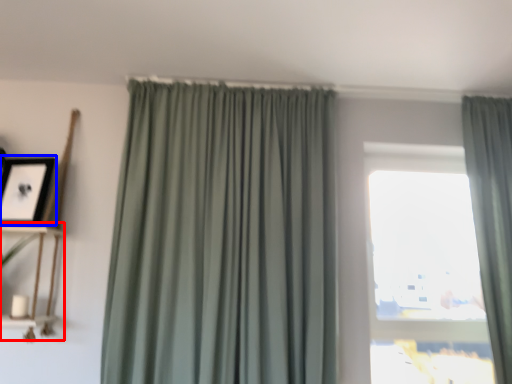
Question: Which point is closer to the camera, shelf (highlighted by a red box) or picture frame (highlighted by a blue box)?

Choices:
 (A) shelf
 (B) picture frame

Answer: (A)